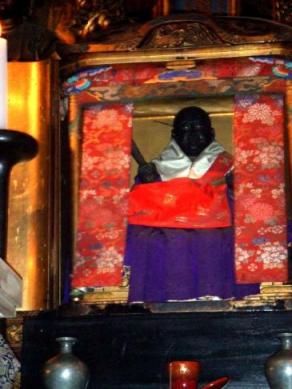
You are a GUI agent. You are given a task and a screenshot of the screen. Output one action in this format:
    pyautogui.click(x=<x>, y=<y>)
    Task: Click on the urn
    This screenshot has width=292, height=389.
    Given the screenshot: What is the action you would take?
    pyautogui.click(x=61, y=375), pyautogui.click(x=286, y=375)